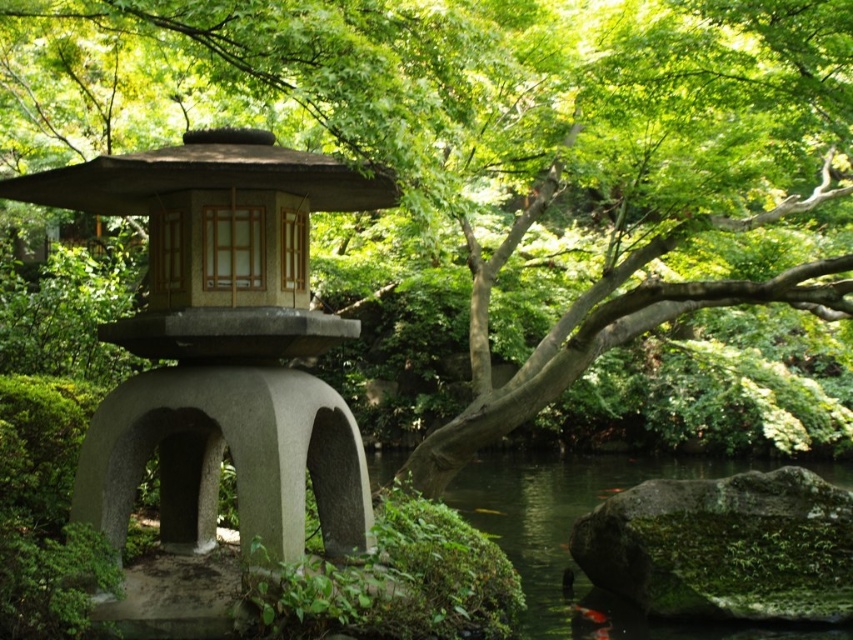
Which is above, matte stone lantern at center or green mossy water at lower center?

matte stone lantern at center is higher up.

Who is positioned more to the right, matte stone lantern at center or green mossy water at lower center?

green mossy water at lower center is more to the right.

Is point (183, 179) more distant than point (769, 627)?

No, (183, 179) is in front of (769, 627).

Locate an element on the screen. matte stone lantern at center is located at coordinates (222, 344).

Is the position of matte stone lantern at center less distant than that of green mossy rock at lower right?

That is True.

How distant is matte stone lantern at center from green mossy rock at lower right?

A distance of 4.03 meters exists between matte stone lantern at center and green mossy rock at lower right.

Is point (163, 358) more distant than point (793, 592)?

No, (163, 358) is in front of (793, 592).

Locate an element on the screen. This screenshot has width=853, height=640. matte stone lantern at center is located at coordinates (222, 344).

Which is above, green mossy rock at lower right or green mossy water at lower center?

Positioned higher is green mossy rock at lower right.

Is green mossy rock at lower right to the left of green mossy water at lower center from the viewer's perspective?

Yes, green mossy rock at lower right is to the left of green mossy water at lower center.

Between point (659, 611) and point (740, 468), which one is positioned in front?

Point (659, 611)

Find the location of `green mossy rock at lower right`. green mossy rock at lower right is located at coordinates (724, 547).